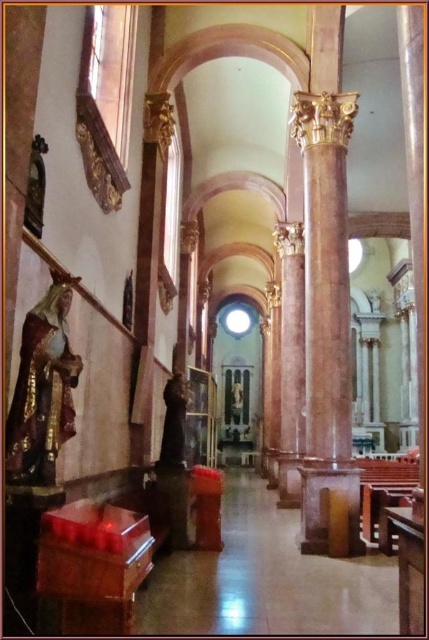
You are an architect assessing the church layout. You need to determine which object is taller between the marble column at center and the gold polished statue at left. Which one is taller?

The marble column at center is taller than the gold polished statue at left according to the description.

You are standing in the nave of the church and want to move towards the altar. As you walk forward, which object will you encounter first, the marble column at center or the gold polished statue at left?

The gold polished statue at left is to the left of the marble column at center, so you will encounter the gold polished statue at left first as you move towards the altar.